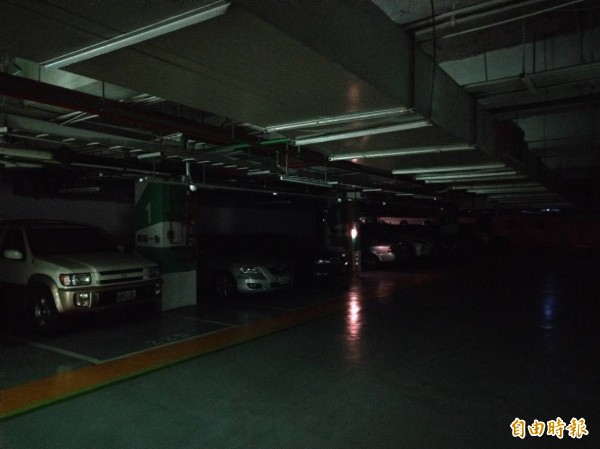
What are the coordinates of `hvac ducts` in the screenshot? It's located at (303, 91).